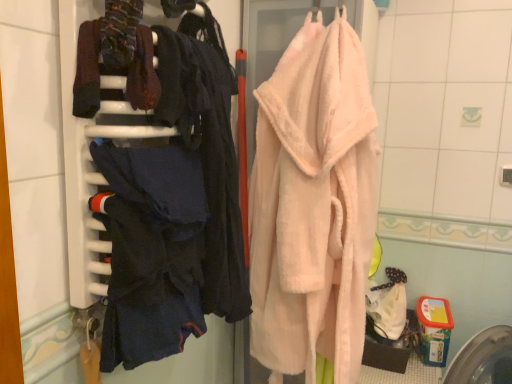
Question: Is dark blue fabric at left to the right of soft pink plush bathrobe at center from the viewer's perspective?

Choices:
 (A) no
 (B) yes

Answer: (A)

Question: Is dark blue fabric at left taller than soft pink plush bathrobe at center?

Choices:
 (A) no
 (B) yes

Answer: (A)

Question: Is dark blue fabric at left aimed at soft pink plush bathrobe at center?

Choices:
 (A) no
 (B) yes

Answer: (A)

Question: Does dark blue fabric at left have a smaller size compared to soft pink plush bathrobe at center?

Choices:
 (A) no
 (B) yes

Answer: (B)

Question: Considering the relative positions of dark blue fabric at left and soft pink plush bathrobe at center in the image provided, is dark blue fabric at left to the left of soft pink plush bathrobe at center from the viewer's perspective?

Choices:
 (A) yes
 (B) no

Answer: (A)

Question: Considering the relative sizes of dark blue fabric at left and soft pink plush bathrobe at center in the image provided, is dark blue fabric at left bigger than soft pink plush bathrobe at center?

Choices:
 (A) yes
 (B) no

Answer: (B)

Question: Can you confirm if dark blue fabric at left is smaller than dark blue fabric at left?

Choices:
 (A) yes
 (B) no

Answer: (B)

Question: Considering the relative sizes of dark blue fabric at left and dark blue fabric at left in the image provided, is dark blue fabric at left taller than dark blue fabric at left?

Choices:
 (A) no
 (B) yes

Answer: (B)

Question: Is dark blue fabric at left oriented away from dark blue fabric at left?

Choices:
 (A) no
 (B) yes

Answer: (B)

Question: Is dark blue fabric at left positioned behind dark blue fabric at left?

Choices:
 (A) yes
 (B) no

Answer: (B)

Question: Does dark blue fabric at left appear on the left side of dark blue fabric at left?

Choices:
 (A) no
 (B) yes

Answer: (B)

Question: From a real-world perspective, does dark blue fabric at left stand above dark blue fabric at left?

Choices:
 (A) no
 (B) yes

Answer: (B)

Question: From the image's perspective, does dark blue fabric at left appear higher than dark blue fabric at left?

Choices:
 (A) yes
 (B) no

Answer: (B)